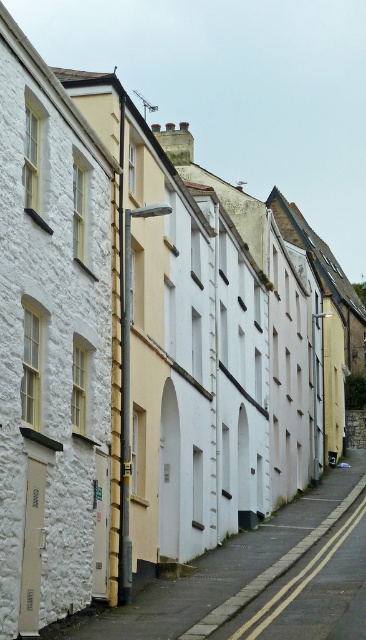
Question: Which of the following is the farthest from the observer?

Choices:
 (A) [337, 529]
 (B) [80, 404]

Answer: (A)

Question: Is white stone building at center bigger than smooth asphalt road at center?

Choices:
 (A) no
 (B) yes

Answer: (A)

Question: Where is white stone building at center located in relation to smooth asphalt road at center in the image?

Choices:
 (A) right
 (B) left

Answer: (B)

Question: Which object appears closest to the camera in this image?

Choices:
 (A) white stone building at center
 (B) smooth asphalt road at center

Answer: (A)

Question: Is white stone building at center above smooth asphalt road at center?

Choices:
 (A) yes
 (B) no

Answer: (A)